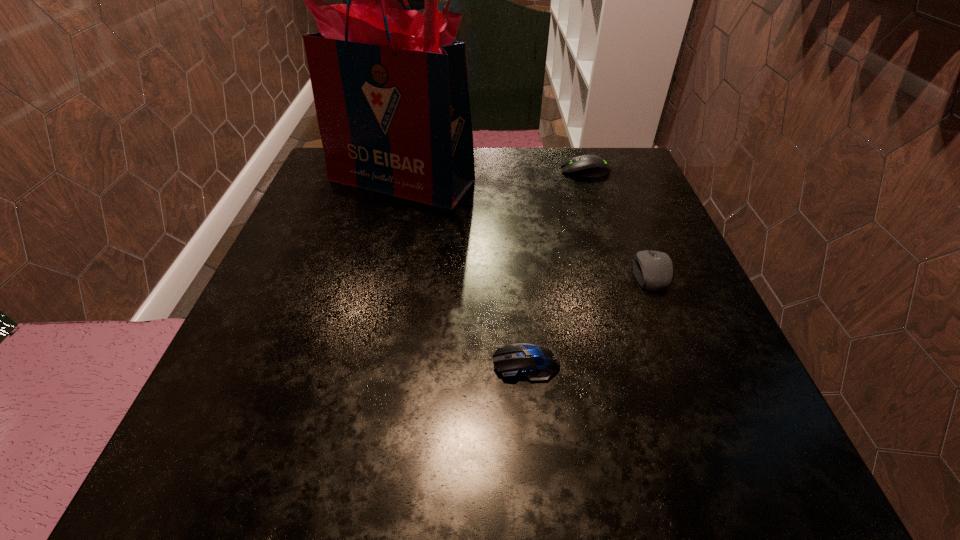
You are a GUI agent. You are given a task and a screenshot of the screen. Output one action in this format:
    pyautogui.click(x=<x>, y=<y>)
    Task: Click on the vacant space that satisfies the following two spatial constraints: 1. on the front side of the third farthest object; 2. on the button side of the nearest computer mouse
    The height and width of the screenshot is (540, 960).
    Given the screenshot: What is the action you would take?
    pyautogui.click(x=686, y=363)

At what (x,y) coordinates should I click in order to perform the action: click on free point that satisfies the following two spatial constraints: 1. on the front-facing side of the second nearest computer mouse; 2. on the right side of the tallest object. Please return your answer as a coordinate pair (x, y). This screenshot has width=960, height=540. Looking at the image, I should click on (379, 273).

I want to click on vacant space that satisfies the following two spatial constraints: 1. on the back side of the second farthest computer mouse; 2. on the wheel side of the farthest computer mouse, so click(610, 171).

Identify the location of vacant space that satisfies the following two spatial constraints: 1. on the front-facing side of the second nearest computer mouse; 2. on the left side of the tallest object. (379, 273).

Where is `vacant position in the image that satisfies the following two spatial constraints: 1. on the front-facing side of the third farthest object; 2. on the right side of the grocery bag`? This screenshot has height=540, width=960. vacant position in the image that satisfies the following two spatial constraints: 1. on the front-facing side of the third farthest object; 2. on the right side of the grocery bag is located at coordinates (379, 273).

Where is `free region that satisfies the following two spatial constraints: 1. on the front-facing side of the tallest object; 2. on the right side of the second farthest computer mouse`? The height and width of the screenshot is (540, 960). free region that satisfies the following two spatial constraints: 1. on the front-facing side of the tallest object; 2. on the right side of the second farthest computer mouse is located at coordinates (379, 273).

The width and height of the screenshot is (960, 540). Identify the location of vacant space that satisfies the following two spatial constraints: 1. on the wheel side of the farthest computer mouse; 2. on the back side of the second farthest computer mouse. (619, 273).